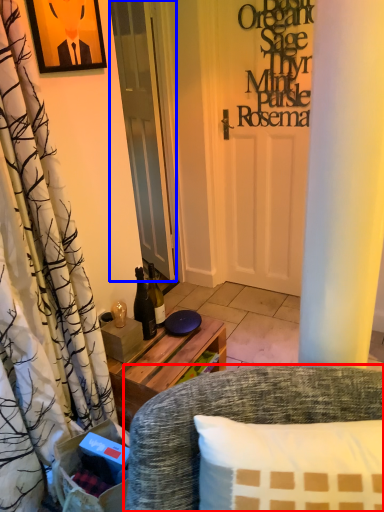
Question: Among these objects, which one is farthest to the camera, chair (highlighted by a red box) or door (highlighted by a blue box)?

Choices:
 (A) chair
 (B) door

Answer: (B)